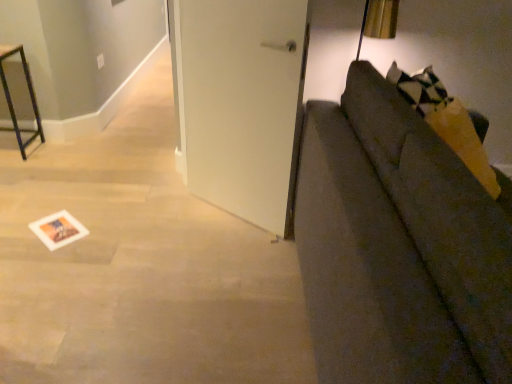
Question: Considering their positions, is metal frame at left located in front of or behind white paper postcard at lower left?

Choices:
 (A) behind
 (B) front

Answer: (A)

Question: In the image, is metal frame at left on the left side or the right side of white paper postcard at lower left?

Choices:
 (A) left
 (B) right

Answer: (A)

Question: Estimate the real-world distances between objects in this image. Which object is farther from the metal frame at left?

Choices:
 (A) white matte door at center
 (B) white paper postcard at lower left
 (C) textured gray couch at right

Answer: (C)

Question: Estimate the real-world distances between objects in this image. Which object is closer to the white paper postcard at lower left?

Choices:
 (A) metal frame at left
 (B) white matte door at center
 (C) textured gray couch at right

Answer: (B)